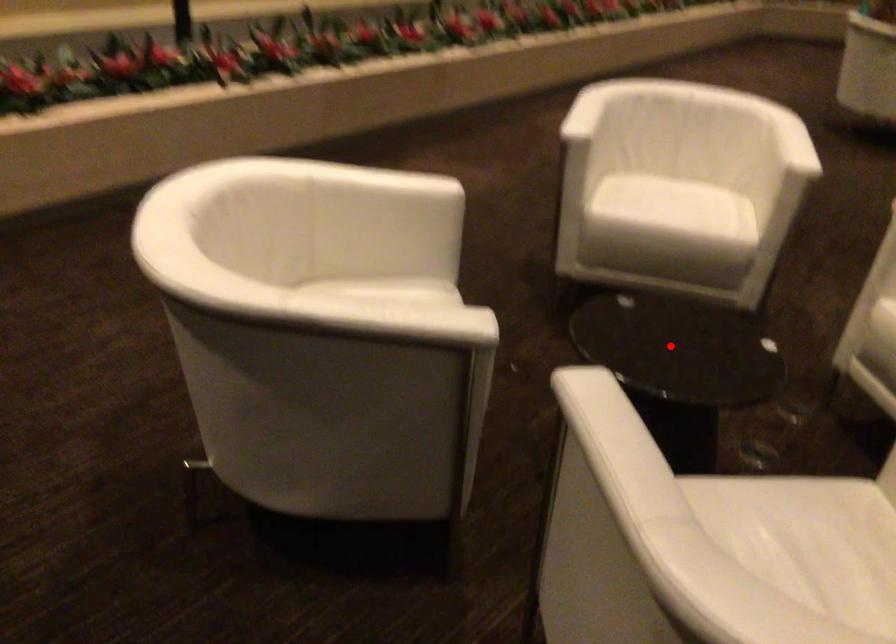
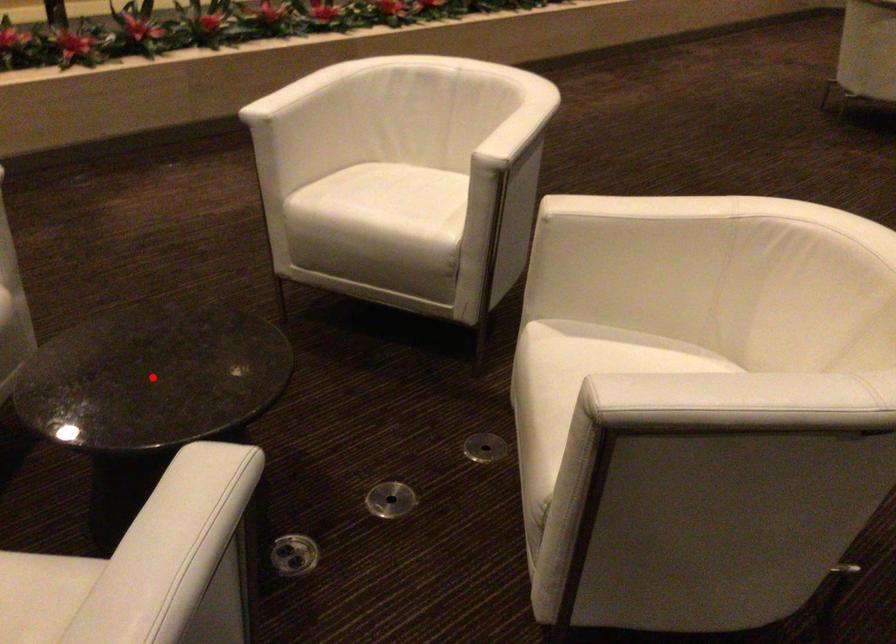
I am providing you with two images of the same scene from different viewpoints. A red point is marked on the first image and another point is marked on the second image. Do the highlighted points in image1 and image2 indicate the same real-world spot?

Yes